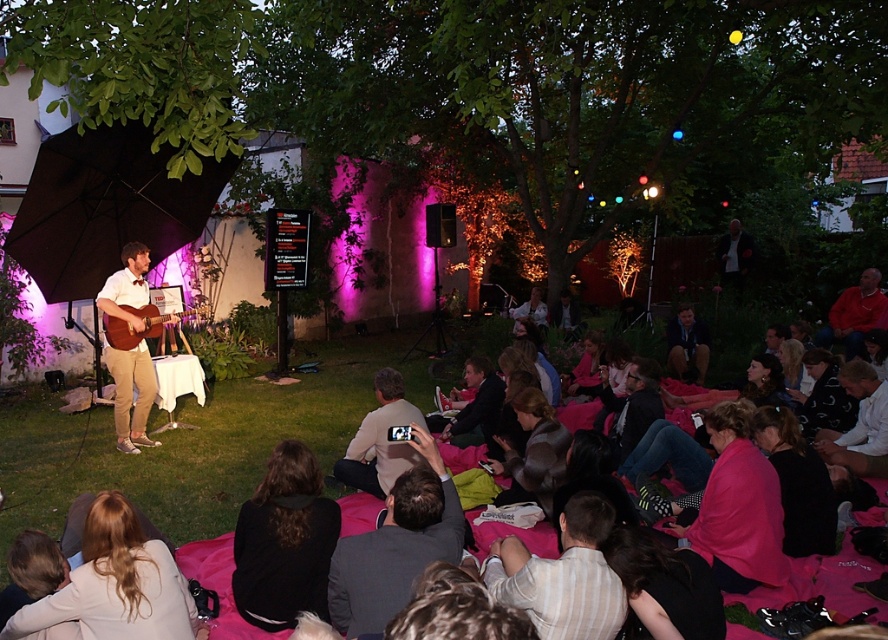
Question: Does dark gray suit at center have a smaller size compared to light brown leather jacket at center?

Choices:
 (A) yes
 (B) no

Answer: (A)

Question: Which of these objects is positioned farthest from the white shirt at upper right?

Choices:
 (A) matte brown guitar at left
 (B) brown matte umbrella at left
 (C) dark gray suit at center

Answer: (C)

Question: Among these points, which one is nearest to the camera?

Choices:
 (A) (115, 339)
 (B) (726, 252)
 (C) (98, 200)
 (D) (841, 307)

Answer: (A)

Question: Does brown matte umbrella at left have a smaller size compared to white shirt at lower right?

Choices:
 (A) no
 (B) yes

Answer: (A)

Question: Can you confirm if striped cotton shirt at lower center is thinner than matte brown guitar at left?

Choices:
 (A) yes
 (B) no

Answer: (B)

Question: Among these points, which one is nearest to the camera?

Choices:
 (A) (873, 417)
 (B) (133, 230)
 (C) (128, 323)
 (D) (853, 330)

Answer: (A)